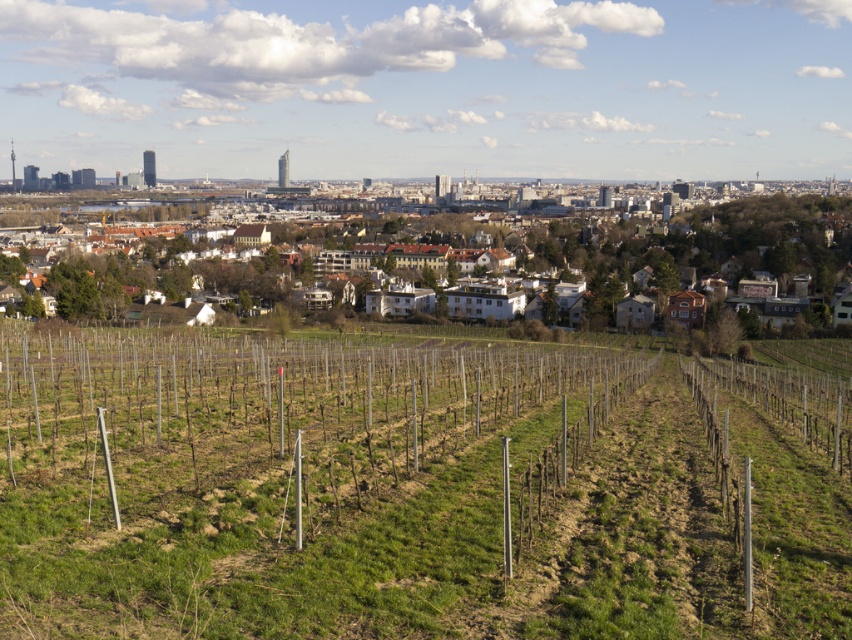
Question: Is green grassy hillside at center positioned behind white textured buildings at center?

Choices:
 (A) no
 (B) yes

Answer: (A)

Question: Which of the following is the closest to the observer?

Choices:
 (A) white textured buildings at center
 (B) green grassy hillside at center

Answer: (B)

Question: Does green grassy hillside at center appear on the left side of white textured buildings at center?

Choices:
 (A) yes
 (B) no

Answer: (B)

Question: Can you confirm if green grassy hillside at center is positioned below white textured buildings at center?

Choices:
 (A) yes
 (B) no

Answer: (A)

Question: Among these objects, which one is farthest from the camera?

Choices:
 (A) white textured buildings at center
 (B) green grassy hillside at center

Answer: (A)